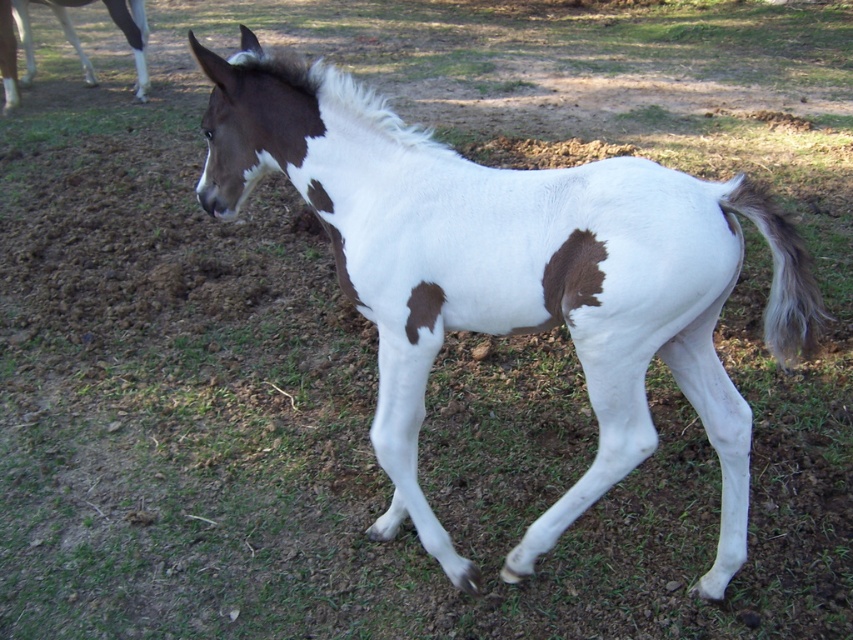
You are a farmer checking the condition of the foal. You notice the white glossy leg at upper left and the brown fuzzy patch at lower right. Which object is covering the other?

The white glossy leg at upper left is positioned over the brown fuzzy patch at lower right, so it is covering it.

Looking at this image, you are a photographer trying to capture the white glossy horse at center and the white silky tail at right. Based on their positions, which one is closer to the camera?

The white glossy horse at center is located above the white silky tail at right, which means the horse is closer to the camera than the tail.